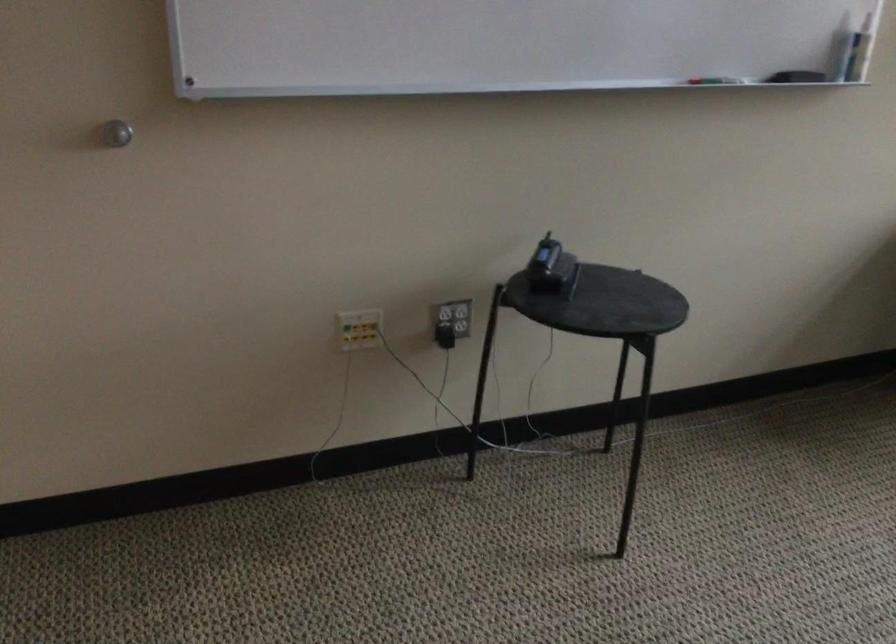
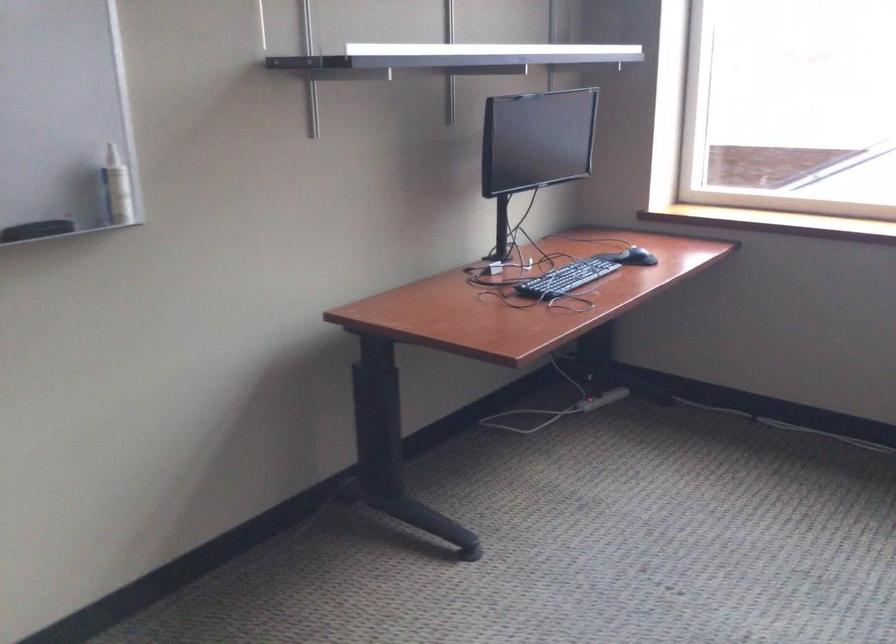
Locate, in the second image, the point that corresponds to (x=788, y=69) in the first image.

(36, 230)